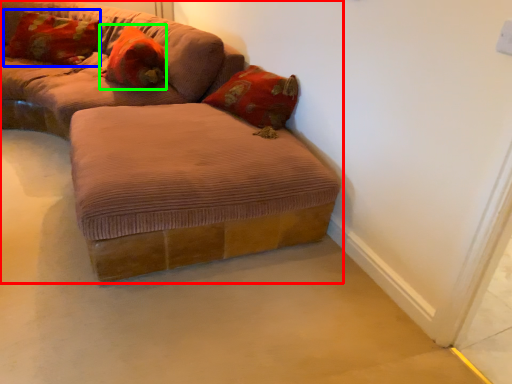
Question: Considering the real-world distances, which object is farthest from studio couch (highlighted by a red box)? pillow (highlighted by a blue box) or pillow (highlighted by a green box)?

Choices:
 (A) pillow
 (B) pillow

Answer: (A)